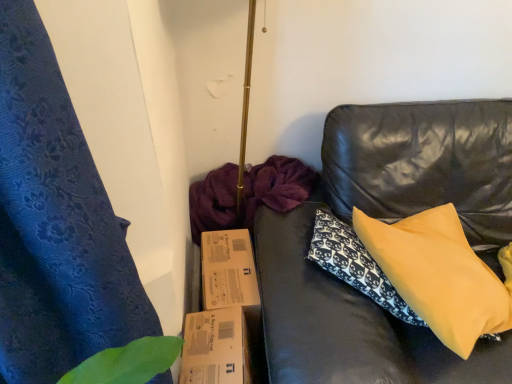
Question: Should I look upward or downward to see brown cardboard box at lower center?

Choices:
 (A) up
 (B) down

Answer: (B)

Question: Could you tell me if brown cardboard box at lower center is facing yellow fabric pillow at right?

Choices:
 (A) yes
 (B) no

Answer: (B)

Question: Does brown cardboard box at lower center appear on the right side of yellow fabric pillow at right?

Choices:
 (A) yes
 (B) no

Answer: (B)

Question: Is brown cardboard box at lower center completely or partially outside of yellow fabric pillow at right?

Choices:
 (A) yes
 (B) no

Answer: (A)

Question: Does brown cardboard box at lower center lie in front of yellow fabric pillow at right?

Choices:
 (A) yes
 (B) no

Answer: (B)

Question: Considering the relative positions of brown cardboard box at lower center and yellow fabric pillow at right in the image provided, is brown cardboard box at lower center behind yellow fabric pillow at right?

Choices:
 (A) no
 (B) yes

Answer: (B)

Question: Can you confirm if brown cardboard box at lower center is positioned to the left of yellow fabric pillow at right?

Choices:
 (A) yes
 (B) no

Answer: (A)

Question: From a real-world perspective, is yellow fabric pillow at right located beneath brown cardboard box at lower center?

Choices:
 (A) no
 (B) yes

Answer: (A)

Question: Considering the relative positions of yellow fabric pillow at right and brown cardboard box at lower center in the image provided, is yellow fabric pillow at right to the left of brown cardboard box at lower center from the viewer's perspective?

Choices:
 (A) no
 (B) yes

Answer: (A)

Question: From the image's perspective, is yellow fabric pillow at right over brown cardboard box at lower center?

Choices:
 (A) no
 (B) yes

Answer: (B)

Question: Is yellow fabric pillow at right directly adjacent to brown cardboard box at lower center?

Choices:
 (A) yes
 (B) no

Answer: (B)

Question: Is yellow fabric pillow at right at the right side of brown cardboard box at lower center?

Choices:
 (A) yes
 (B) no

Answer: (A)

Question: Does yellow fabric pillow at right have a lesser height compared to brown cardboard box at lower center?

Choices:
 (A) yes
 (B) no

Answer: (A)

Question: From the image's perspective, is yellow fabric pillow at right positioned above or below brown cardboard box at lower center?

Choices:
 (A) above
 (B) below

Answer: (A)